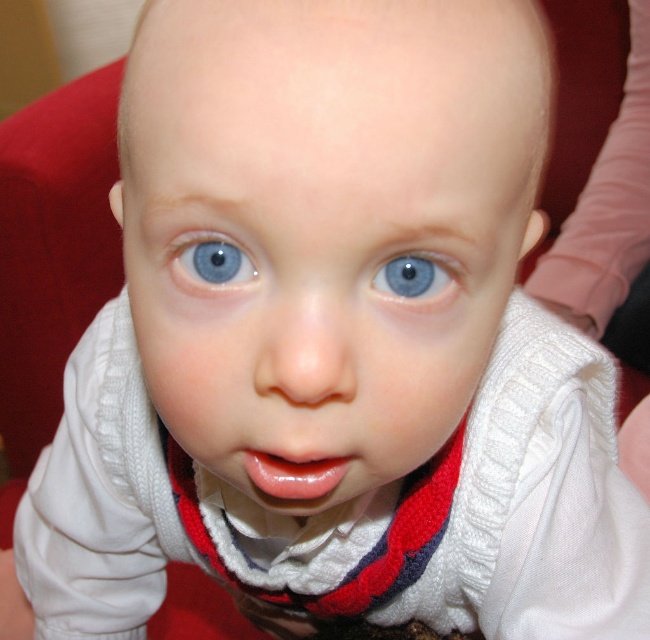
Between glossy pink lips at center and blue smooth eye at center, which one is positioned lower?

glossy pink lips at center

Which of these two, glossy pink lips at center or blue smooth eye at center, stands shorter?

blue smooth eye at center

Image resolution: width=650 pixels, height=640 pixels. What do you see at coordinates (292, 476) in the screenshot? I see `glossy pink lips at center` at bounding box center [292, 476].

You are a GUI agent. You are given a task and a screenshot of the screen. Output one action in this format:
    pyautogui.click(x=<x>, y=<y>)
    Task: Click on the glossy pink lips at center
    
    Given the screenshot: What is the action you would take?
    pyautogui.click(x=292, y=476)

Is glossy pink lips at center in front of blue glossy eye at center?

That is False.

Is glossy pink lips at center shorter than blue glossy eye at center?

In fact, glossy pink lips at center may be taller than blue glossy eye at center.

Does point (328, 458) lie in front of point (430, 260)?

No, (328, 458) is behind (430, 260).

This screenshot has width=650, height=640. Identify the location of glossy pink lips at center. pos(292,476).

Does blue smooth eye at center have a greater height compared to blue glossy eye at center?

Yes.

Which is more to the right, blue smooth eye at center or blue glossy eye at center?

Positioned to the right is blue glossy eye at center.

Is point (213, 269) in front of point (403, 273)?

No.

Where is `blue smooth eye at center`? blue smooth eye at center is located at coordinates (214, 260).